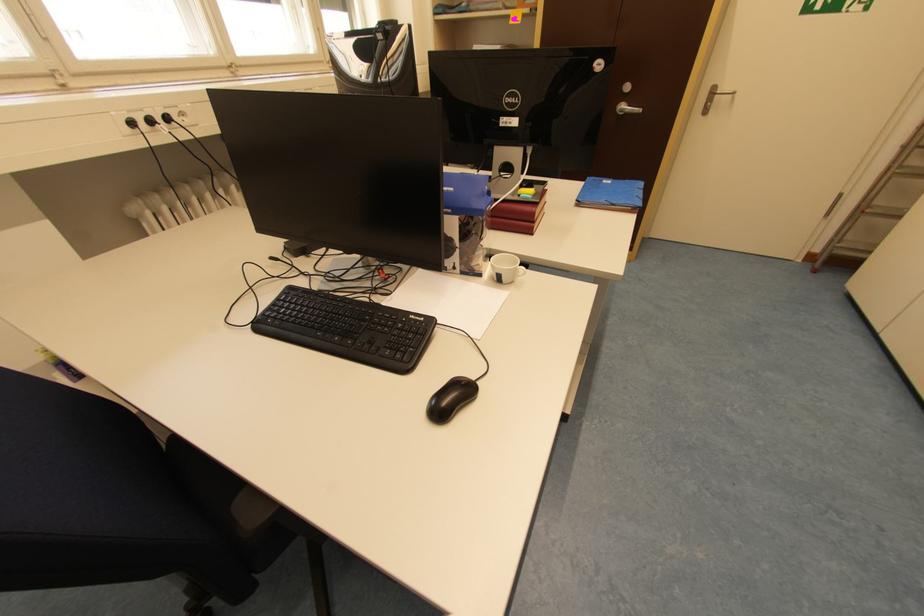
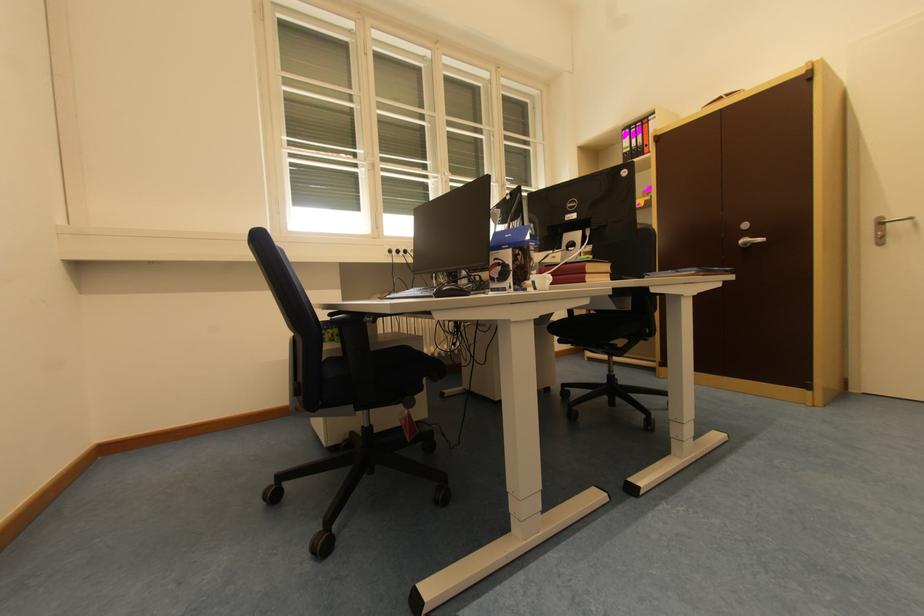
The images are taken continuously from a first-person perspective. In which direction is your viewpoint rotating?

The rotation direction of the camera is left-up.